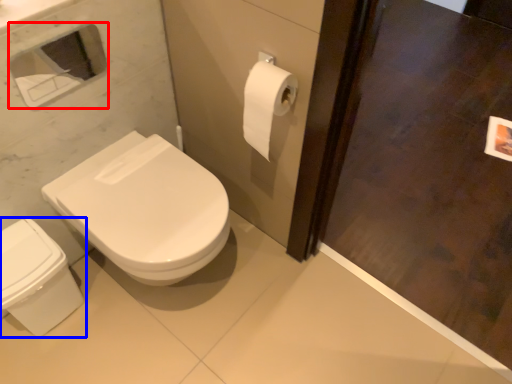
Question: Which point is closer to the camera, medicine cabinet (highlighted by a red box) or bidet (highlighted by a blue box)?

Choices:
 (A) medicine cabinet
 (B) bidet

Answer: (A)